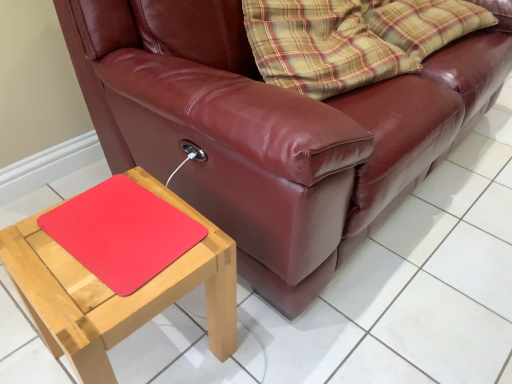
Where is `natural wood table at lower left`? This screenshot has height=384, width=512. natural wood table at lower left is located at coordinates (114, 293).

Where is `rubberized red mouse pad at lower left`? The width and height of the screenshot is (512, 384). rubberized red mouse pad at lower left is located at coordinates [x=122, y=233].

Find the location of a particular element. natural wood table at lower left is located at coordinates (114, 293).

From a real-world perspective, which is physically above, leather couch at center or rubberized red mouse pad at lower left?

leather couch at center.

From the image's perspective, which one is positioned higher, leather couch at center or rubberized red mouse pad at lower left?

leather couch at center is shown above in the image.

Considering the relative positions of leather couch at center and rubberized red mouse pad at lower left in the image provided, is leather couch at center behind rubberized red mouse pad at lower left?

No, leather couch at center is closer to the camera.

Looking at this image, does leather couch at center appear on the right side of rubberized red mouse pad at lower left?

Indeed, leather couch at center is positioned on the right side of rubberized red mouse pad at lower left.

Find the location of a particular element. This screenshot has width=512, height=384. table that is under the rubberized red mouse pad at lower left (from a real-world perspective) is located at coordinates (114, 293).

Are natural wood table at lower left and rubberized red mouse pad at lower left located far from each other?

natural wood table at lower left is near rubberized red mouse pad at lower left, not far away.

Considering the sizes of objects natural wood table at lower left and rubberized red mouse pad at lower left in the image provided, who is bigger, natural wood table at lower left or rubberized red mouse pad at lower left?

natural wood table at lower left.

Which object is further away from the camera, natural wood table at lower left or rubberized red mouse pad at lower left?

rubberized red mouse pad at lower left is behind.

Measure the distance from leather couch at center to natural wood table at lower left.

leather couch at center is 14.88 inches away from natural wood table at lower left.

In the image, is leather couch at center on the left side or the right side of natural wood table at lower left?

From the image, it's evident that leather couch at center is to the right of natural wood table at lower left.

From a real-world perspective, is leather couch at center beneath natural wood table at lower left?

Incorrect, from a real-world perspective, leather couch at center is higher than natural wood table at lower left.

Looking at this image, which of these two, leather couch at center or natural wood table at lower left, is wider?

Wider between the two is leather couch at center.

Based on the photo, considering the relative sizes of rubberized red mouse pad at lower left and natural wood table at lower left in the image provided, is rubberized red mouse pad at lower left thinner than natural wood table at lower left?

Yes.

The image size is (512, 384). What are the coordinates of `table below the rubberized red mouse pad at lower left (from the image's perspective)` in the screenshot? It's located at (114, 293).

Based on the photo, considering the sizes of rubberized red mouse pad at lower left and natural wood table at lower left in the image, is rubberized red mouse pad at lower left bigger or smaller than natural wood table at lower left?

In the image, rubberized red mouse pad at lower left appears to be smaller than natural wood table at lower left.

From a real-world perspective, is rubberized red mouse pad at lower left beneath natural wood table at lower left?

No, from a real-world perspective, rubberized red mouse pad at lower left is not beneath natural wood table at lower left.

How many degrees apart are the facing directions of natural wood table at lower left and leather couch at center?

There is a 3.87-degree angle between the facing directions of natural wood table at lower left and leather couch at center.

Is leather couch at center at the back of natural wood table at lower left?

natural wood table at lower left does not have its back to leather couch at center.

Looking at this image, from the image's perspective, is natural wood table at lower left positioned above or below leather couch at center?

Based on their image positions, natural wood table at lower left is located beneath leather couch at center.

Is natural wood table at lower left thinner than leather couch at center?

Correct, the width of natural wood table at lower left is less than that of leather couch at center.

In terms of height, does rubberized red mouse pad at lower left look taller or shorter compared to leather couch at center?

Clearly, rubberized red mouse pad at lower left is shorter compared to leather couch at center.

Does point (109, 245) come in front of point (179, 4)?

That is True.

Would you say rubberized red mouse pad at lower left is outside leather couch at center?

Indeed, rubberized red mouse pad at lower left is completely outside leather couch at center.

From the image's perspective, relative to leather couch at center, is rubberized red mouse pad at lower left above or below?

Clearly, from the image's perspective, rubberized red mouse pad at lower left is below leather couch at center.

I want to click on studio couch that is above the rubberized red mouse pad at lower left (from the image's perspective), so click(x=271, y=129).

This screenshot has width=512, height=384. Find the location of `table below the rubberized red mouse pad at lower left (from a real-world perspective)`. table below the rubberized red mouse pad at lower left (from a real-world perspective) is located at coordinates (114, 293).

Estimate the real-world distances between objects in this image. Which object is closer to natural wood table at lower left, rubberized red mouse pad at lower left or leather couch at center?

rubberized red mouse pad at lower left is closer to natural wood table at lower left.

Considering their positions, is rubberized red mouse pad at lower left positioned closer to leather couch at center than natural wood table at lower left?

The object closer to leather couch at center is natural wood table at lower left.

Looking at the image, which one is located closer to natural wood table at lower left, leather couch at center or rubberized red mouse pad at lower left?

rubberized red mouse pad at lower left is positioned closer to the anchor natural wood table at lower left.

Estimate the real-world distances between objects in this image. Which object is further from leather couch at center, natural wood table at lower left or rubberized red mouse pad at lower left?

rubberized red mouse pad at lower left.

Which object lies nearer to the anchor point rubberized red mouse pad at lower left, natural wood table at lower left or leather couch at center?

natural wood table at lower left lies closer to rubberized red mouse pad at lower left than the other object.

Looking at the image, which one is located closer to rubberized red mouse pad at lower left, leather couch at center or natural wood table at lower left?

natural wood table at lower left is positioned closer to the anchor rubberized red mouse pad at lower left.

This screenshot has height=384, width=512. What are the coordinates of `mat between leather couch at center and natural wood table at lower left vertically` in the screenshot? It's located at (122, 233).